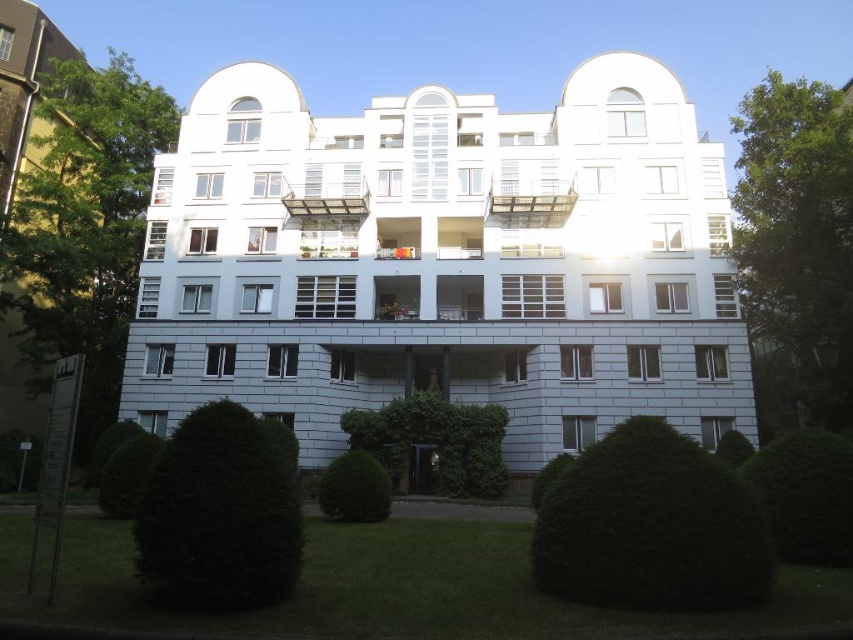
Question: Which of the following is the closest to the observer?

Choices:
 (A) green textured bush at center
 (B) green leafy bush at center
 (C) dark green leafy bush at lower center
 (D) white stone building at center

Answer: (C)

Question: Which object is the farthest from the green leafy hedge at lower right?

Choices:
 (A) white stone building at center
 (B) green textured bush at center
 (C) green leafy bush at center
 (D) dark green leafy bush at lower center

Answer: (A)

Question: Is dark green textured bush at lower left closer to camera compared to green leafy hedge at lower right?

Choices:
 (A) no
 (B) yes

Answer: (B)

Question: Is green leafy tree at right closer to the viewer compared to dark green textured bush at lower left?

Choices:
 (A) yes
 (B) no

Answer: (B)

Question: Where is dark green textured bush at lower left located in relation to green leafy bush at center in the image?

Choices:
 (A) right
 (B) left

Answer: (B)

Question: Which object is farther from the camera taking this photo?

Choices:
 (A) green leafy tree at left
 (B) white stone building at center
 (C) green leafy bush at center
 (D) green leafy hedge at lower right

Answer: (A)